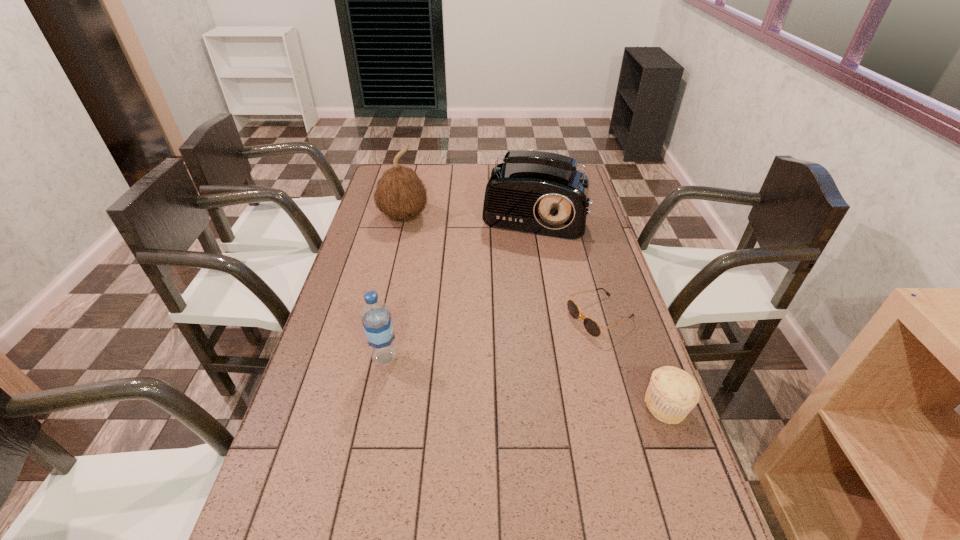
Locate an element on the screen. vacant space on the desktop that is between the third tallest object and the fourth tallest object and is positioned on the front-facing side of the radio receiver is located at coordinates (479, 374).

The height and width of the screenshot is (540, 960). What are the coordinates of `free space on the desktop that is between the water bottle and the muffin and is positioned on the lenses of the shortest object` in the screenshot? It's located at (480, 374).

At what (x,y) coordinates should I click in order to perform the action: click on vacant space on the desktop that is between the fourth farthest object and the muffin and is positioned on the surface of the coconut. Please return your answer as a coordinate pair (x, y). This screenshot has width=960, height=540. Looking at the image, I should click on (546, 386).